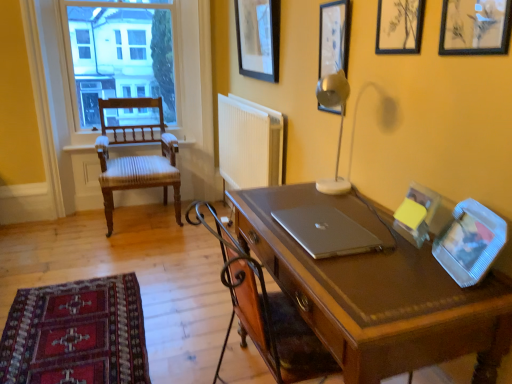
Measure the distance between matte brown desk at center and camera.

They are 35.54 inches apart.

The width and height of the screenshot is (512, 384). What are the coordinates of `silver metallic laptop at center` in the screenshot? It's located at (327, 232).

What is the approximate width of black matte picture frame at upper right, arranged as the first picture frame when viewed from the front?

It is 5.31 centimeters.

What do you see at coordinates (475, 27) in the screenshot? I see `black matte picture frame at upper right, placed as the fifth picture frame when sorted from left to right` at bounding box center [475, 27].

Image resolution: width=512 pixels, height=384 pixels. Describe the element at coordinates (258, 38) in the screenshot. I see `black matte picture frame at upper center, which is the 5th picture frame from right to left` at that location.

In order to face clear glass window at upper left, should I rotate leftwards or rightwards?

Turn left by 16.766 degrees to look at clear glass window at upper left.

What is the approximate width of wooden chair with striped cushioning at left?

wooden chair with striped cushioning at left is 25.83 inches in width.

This screenshot has width=512, height=384. Identify the location of wooden chair with striped cushioning at left. (137, 157).

What are the coordinates of `matte brown desk at center` in the screenshot? It's located at (377, 293).

In order to click on picture frame located underneath the metallic silver picture frame at upper right, placed as the fourth picture frame when sorted from front to back (from a real-world perspective) in this screenshot , I will do `click(470, 242)`.

Considering the relative sizes of clear plastic picture frame at right, which is the 4th picture frame in left-to-right order, and metallic silver picture frame at upper right, placed as the fourth picture frame when sorted from front to back, in the image provided, is clear plastic picture frame at right, which is the 4th picture frame in left-to-right order, shorter than metallic silver picture frame at upper right, placed as the fourth picture frame when sorted from front to back,?

Yes, clear plastic picture frame at right, which is the 4th picture frame in left-to-right order, is shorter than metallic silver picture frame at upper right, placed as the fourth picture frame when sorted from front to back.

Is metallic silver picture frame at upper right, the fourth picture frame viewed from the right, surrounded by clear plastic picture frame at right, arranged as the 2th picture frame when viewed from the front?

No, metallic silver picture frame at upper right, the fourth picture frame viewed from the right, is not surrounded by clear plastic picture frame at right, arranged as the 2th picture frame when viewed from the front.

Which is nearer, (438, 243) or (342, 12)?

The point (438, 243) is closer to the camera.

In terms of height, does metallic silver picture frame at upper right, which is the 2th picture frame in back-to-front order, look taller or shorter compared to black matte picture frame at upper center, the 1th picture frame in the back-to-front sequence?

Clearly, metallic silver picture frame at upper right, which is the 2th picture frame in back-to-front order, is shorter compared to black matte picture frame at upper center, the 1th picture frame in the back-to-front sequence.

Is metallic silver picture frame at upper right, the fourth picture frame viewed from the right, located outside black matte picture frame at upper center, the 1th picture frame in the back-to-front sequence?

Indeed, metallic silver picture frame at upper right, the fourth picture frame viewed from the right, is completely outside black matte picture frame at upper center, the 1th picture frame in the back-to-front sequence.

In the scene shown: Between metallic silver picture frame at upper right, the fourth picture frame viewed from the right, and black matte picture frame at upper center, acting as the 1th picture frame starting from the left, which one has larger width?

black matte picture frame at upper center, acting as the 1th picture frame starting from the left, is wider.

Is metallic silver picture frame at upper right, placed as the fourth picture frame when sorted from front to back, behind black matte picture frame at upper center, the 1th picture frame in the back-to-front sequence?

No, the depth of metallic silver picture frame at upper right, placed as the fourth picture frame when sorted from front to back, is less than that of black matte picture frame at upper center, the 1th picture frame in the back-to-front sequence.

Which is farther from the camera, (x=309, y=239) or (x=353, y=125)?

The point (x=353, y=125) is farther from the camera.

Is silver metallic laptop at center with metallic silver table lamp at upper right?

There is a gap between silver metallic laptop at center and metallic silver table lamp at upper right.

From a real-world perspective, is silver metallic laptop at center above or below metallic silver table lamp at upper right?

From a real-world perspective, silver metallic laptop at center is physically below metallic silver table lamp at upper right.

Considering the relative sizes of silver metallic laptop at center and metallic silver table lamp at upper right in the image provided, is silver metallic laptop at center taller than metallic silver table lamp at upper right?

No, silver metallic laptop at center is not taller than metallic silver table lamp at upper right.

Between black matte picture frame at upper right, positioned as the 1th picture frame in right-to-left order, and clear glass window at upper left, which one has larger width?

clear glass window at upper left is wider.

From a real-world perspective, starting from the clear glass window at upper left, which picture frame is the 4th one vertically above it? Please provide its 2D coordinates.

[(475, 27)]

From the picture: Could you tell me if black matte picture frame at upper right, positioned as the 1th picture frame in right-to-left order, is facing clear glass window at upper left?

No.

Considering the relative sizes of matte brown desk at center and black matte picture frame at upper right, placed as the fifth picture frame when sorted from left to right, in the image provided, is matte brown desk at center taller than black matte picture frame at upper right, placed as the fifth picture frame when sorted from left to right,?

Indeed, matte brown desk at center has a greater height compared to black matte picture frame at upper right, placed as the fifth picture frame when sorted from left to right.

Is black matte picture frame at upper right, which is the fifth picture frame in back-to-front order, completely or partially inside matte brown desk at center?

No.

Between point (332, 336) and point (440, 36), which one is positioned behind?

Point (440, 36)

Are wooden picture frame at upper right, placed as the 3th picture frame when sorted from back to front, and silver metallic laptop at center making contact?

No.

Is silver metallic laptop at center inside wooden picture frame at upper right, which is the 3th picture frame in front-to-back order?

Definitely not — silver metallic laptop at center is not inside wooden picture frame at upper right, which is the 3th picture frame in front-to-back order.

Which of these two, wooden picture frame at upper right, which is the 3th picture frame in front-to-back order, or silver metallic laptop at center, is smaller?

silver metallic laptop at center.

In the scene shown: From the image's perspective, is wooden picture frame at upper right, placed as the 3th picture frame when sorted from back to front, below silver metallic laptop at center?

No.

Measure the distance between clear glass window at upper left and silver metallic laptop at center.

A distance of 8.25 feet exists between clear glass window at upper left and silver metallic laptop at center.

Is silver metallic laptop at center a part of clear glass window at upper left?

No.

Would you consider clear glass window at upper left to be distant from silver metallic laptop at center?

Yes.

Is clear glass window at upper left facing towards silver metallic laptop at center?

Yes.

From the image's perspective, starting from the clear plastic picture frame at right, acting as the 2th picture frame starting from the right, which picture frame is the 1st one above? Please provide its 2D coordinates.

[(334, 37)]

Locate an element on the screen. picture frame behind the metallic silver picture frame at upper right, placed as the fourth picture frame when sorted from front to back is located at coordinates (258, 38).

From the image, which object appears to be nearer to wooden picture frame at upper right, which is the 3th picture frame in front-to-back order, clear plastic picture frame at right, which is the 4th picture frame in left-to-right order, or matte brown desk at center?

clear plastic picture frame at right, which is the 4th picture frame in left-to-right order, is closer to wooden picture frame at upper right, which is the 3th picture frame in front-to-back order.

Which object lies nearer to the anchor point matte brown desk at center, clear glass window at upper left or black matte picture frame at upper center, acting as the 1th picture frame starting from the left?

black matte picture frame at upper center, acting as the 1th picture frame starting from the left, lies closer to matte brown desk at center than the other object.

Considering their positions, is metallic silver picture frame at upper right, the fourth picture frame viewed from the right, positioned closer to clear plastic picture frame at right, acting as the 2th picture frame starting from the right, than black matte picture frame at upper right, placed as the fifth picture frame when sorted from left to right?

Based on the image, black matte picture frame at upper right, placed as the fifth picture frame when sorted from left to right, appears to be nearer to clear plastic picture frame at right, acting as the 2th picture frame starting from the right.

Considering their positions, is wooden chair with striped cushioning at left positioned closer to clear glass window at upper left than wooden picture frame at upper right, the third picture frame from the right?

wooden chair with striped cushioning at left is closer to clear glass window at upper left.

Estimate the real-world distances between objects in this image. Which object is closer to black matte picture frame at upper right, arranged as the first picture frame when viewed from the front, wooden picture frame at upper right, the 3th picture frame from the left, or clear glass window at upper left?

Among the two, wooden picture frame at upper right, the 3th picture frame from the left, is located nearer to black matte picture frame at upper right, arranged as the first picture frame when viewed from the front.

Based on their spatial positions, is clear plastic picture frame at right, which is the 4th picture frame in left-to-right order, or clear glass window at upper left closer to wooden picture frame at upper right, placed as the 3th picture frame when sorted from back to front?

Based on the image, clear plastic picture frame at right, which is the 4th picture frame in left-to-right order, appears to be nearer to wooden picture frame at upper right, placed as the 3th picture frame when sorted from back to front.

Looking at the image, which one is located closer to black matte picture frame at upper center, acting as the 1th picture frame starting from the left, wooden picture frame at upper right, placed as the 3th picture frame when sorted from back to front, or black matte picture frame at upper right, placed as the fifth picture frame when sorted from left to right?

The object closer to black matte picture frame at upper center, acting as the 1th picture frame starting from the left, is wooden picture frame at upper right, placed as the 3th picture frame when sorted from back to front.

Which object lies nearer to the anchor point metallic silver table lamp at upper right, clear plastic picture frame at right, arranged as the 2th picture frame when viewed from the front, or black matte picture frame at upper center, which is the 5th picture frame from right to left?

clear plastic picture frame at right, arranged as the 2th picture frame when viewed from the front.

Image resolution: width=512 pixels, height=384 pixels. I want to click on picture frame situated between clear glass window at upper left and metallic silver picture frame at upper right, the second picture frame positioned from the left, from left to right, so click(x=258, y=38).

Locate an element on the screen. This screenshot has height=384, width=512. chair between wooden picture frame at upper right, the 3th picture frame from the left, and clear glass window at upper left in the front-back direction is located at coordinates [x=137, y=157].

Identify the location of laptop between wooden picture frame at upper right, the third picture frame from the right, and matte brown desk at center vertically. This screenshot has width=512, height=384. (327, 232).

The height and width of the screenshot is (384, 512). Find the location of `chair positioned between metallic silver table lamp at upper right and clear glass window at upper left from near to far`. chair positioned between metallic silver table lamp at upper right and clear glass window at upper left from near to far is located at coordinates (137, 157).